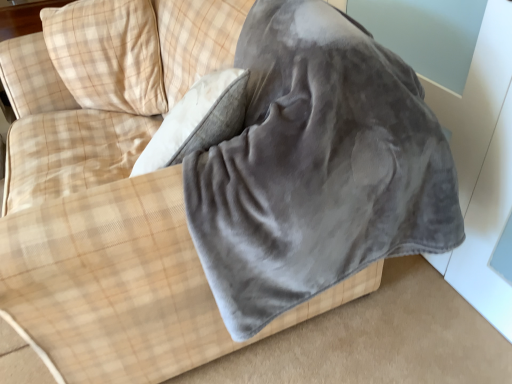
Question: In the image, is beige plaid pillow at upper left positioned in front of or behind gray fleece blanket at center?

Choices:
 (A) front
 (B) behind

Answer: (B)

Question: From the image's perspective, relative to gray fleece blanket at center, is beige plaid pillow at upper left above or below?

Choices:
 (A) above
 (B) below

Answer: (A)

Question: Is beige plaid pillow at upper left inside or outside of gray fleece blanket at center?

Choices:
 (A) inside
 (B) outside

Answer: (B)

Question: From the image's perspective, is gray fleece blanket at center located above or below beige plaid pillow at upper left?

Choices:
 (A) below
 (B) above

Answer: (A)

Question: Considering the positions of gray fleece blanket at center and beige plaid pillow at upper left in the image, is gray fleece blanket at center bigger or smaller than beige plaid pillow at upper left?

Choices:
 (A) small
 (B) big

Answer: (B)

Question: From a real-world perspective, is gray fleece blanket at center physically located above or below beige plaid pillow at upper left?

Choices:
 (A) above
 (B) below

Answer: (B)

Question: Considering the positions of gray fleece blanket at center and beige plaid pillow at upper left in the image, is gray fleece blanket at center taller or shorter than beige plaid pillow at upper left?

Choices:
 (A) tall
 (B) short

Answer: (A)